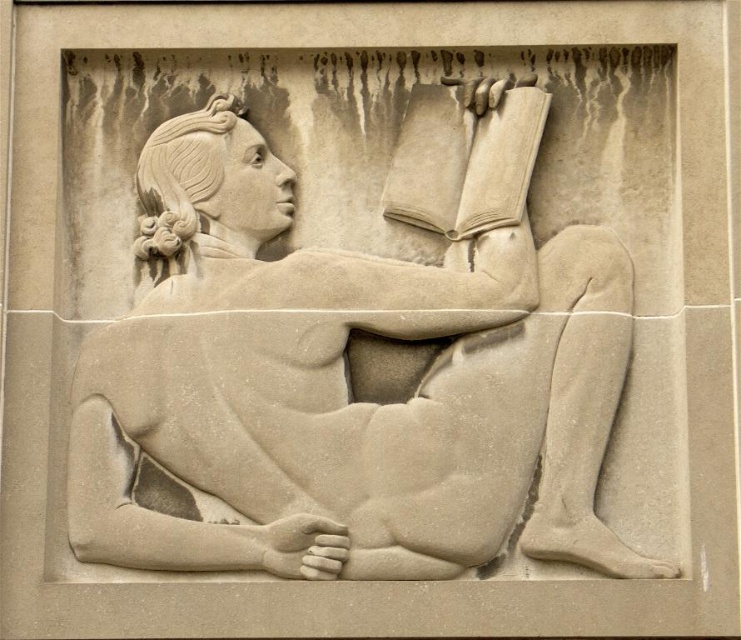
From the picture: You are an art conservator examining the relief sculpture. You need to clean both the sandstone statue of reclining figure reading at center and the smooth beige book at upper center. Which object should you start with if you want to work on the one closer to you first?

The sandstone statue of reclining figure reading at center is closer to the viewer than the smooth beige book at upper center, so you should start cleaning the sandstone statue of reclining figure reading at center first.